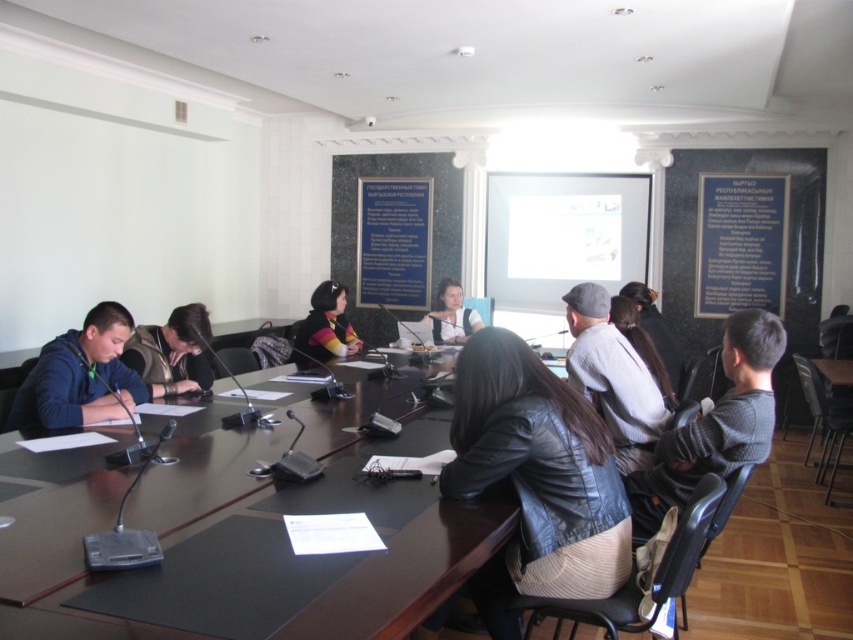
Is black leather table at center below gray knit cap at center?

Indeed, black leather table at center is positioned under gray knit cap at center.

Does black leather table at center have a lesser height compared to gray knit cap at center?

Yes, black leather table at center is shorter than gray knit cap at center.

Between point (219, 616) and point (619, 406), which one is positioned in front?

Point (219, 616) is in front.

Where is `black leather table at center`? The width and height of the screenshot is (853, 640). black leather table at center is located at coordinates (241, 547).

Does black leather table at center appear on the right side of blue denim jacket at lower left?

Correct, you'll find black leather table at center to the right of blue denim jacket at lower left.

From the picture: Does black leather table at center have a greater width compared to blue denim jacket at lower left?

Indeed, black leather table at center has a greater width compared to blue denim jacket at lower left.

Locate an element on the screen. The height and width of the screenshot is (640, 853). black leather table at center is located at coordinates (241, 547).

Which of these two, leather jacket at center or dark brown leather jacket at center, stands shorter?

With less height is dark brown leather jacket at center.

Is leather jacket at center wider than dark brown leather jacket at center?

Indeed, leather jacket at center has a greater width compared to dark brown leather jacket at center.

Where is `leather jacket at center`? This screenshot has width=853, height=640. leather jacket at center is located at coordinates (535, 480).

The height and width of the screenshot is (640, 853). Find the location of `leather jacket at center`. leather jacket at center is located at coordinates (535, 480).